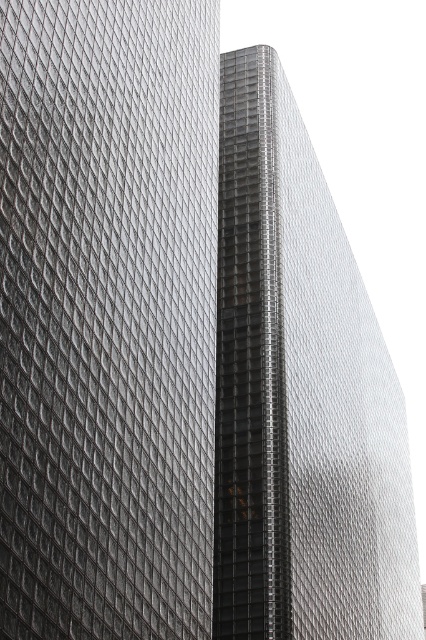
You are a drone operator planning to fly a drone between the two buildings. The drone has a wingspan of 3 meters. Based on the scene, can the drone safely pass through the space between the metallic glass skyscraper at left and the metallic glass tower at center?

The metallic glass skyscraper at left is 37.32 meters from the metallic glass tower at center. Since the drone has a wingspan of 3 meters, the distance between the buildings is more than sufficient for the drone to safely pass through.

You are an architect analyzing the structural integrity of the buildings in the image. Based on their positions, which metallic glass skyscraper at left or metallic glass tower at center is positioned higher relative to the other?

The metallic glass skyscraper at left is positioned higher than the metallic glass tower at center.